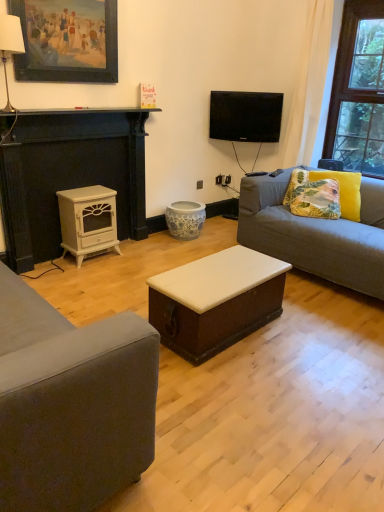
Question: Considering their positions, is floral fabric cushion at right, marked as the 2th pillow in a left-to-right arrangement, located in front of or behind white painted wood stove at left, placed as the second table when sorted from bottom to top?

Choices:
 (A) behind
 (B) front

Answer: (A)

Question: Based on their positions, is floral fabric cushion at right, which ranks as the 1th pillow in right-to-left order, located to the left or right of white painted wood stove at left, which is counted as the first table, starting from the back?

Choices:
 (A) right
 (B) left

Answer: (A)

Question: Which of these objects is positioned farthest from the white painted wood fireplace at left?

Choices:
 (A) floral fabric cushion at right, which ranks as the 1th pillow in right-to-left order
 (B) white painted wood stove at left, placed as the 2th table when sorted from right to left
 (C) black glossy tv at upper center
 (D) wooden picture frame at upper left
 (E) gray fabric couch at right

Answer: (A)

Question: Which of these objects is positioned closest to the black glossy tv at upper center?

Choices:
 (A) white painted wood stove at left, which is counted as the 1th table, starting from the left
 (B) floral fabric cushion at right, which ranks as the 1th pillow in right-to-left order
 (C) white fabric lampshade at upper left
 (D) gray fabric couch at right
 (E) white painted wood fireplace at left

Answer: (B)